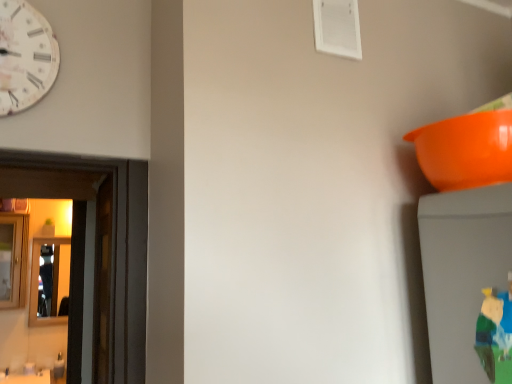
Question: Does shiny silver mirror at left, which appears as the 2th mirror when viewed from the front, have a larger size compared to orange plastic bowl at upper right?

Choices:
 (A) yes
 (B) no

Answer: (A)

Question: Is shiny silver mirror at left, the first mirror positioned from the back, in front of orange plastic bowl at upper right?

Choices:
 (A) no
 (B) yes

Answer: (A)

Question: From the image's perspective, is shiny silver mirror at left, which appears as the 2th mirror when viewed from the front, over orange plastic bowl at upper right?

Choices:
 (A) yes
 (B) no

Answer: (B)

Question: Is orange plastic bowl at upper right inside shiny silver mirror at left, which appears as the 2th mirror when viewed from the front?

Choices:
 (A) yes
 (B) no

Answer: (B)

Question: Does shiny silver mirror at left, the first mirror positioned from the back, appear on the right side of orange plastic bowl at upper right?

Choices:
 (A) no
 (B) yes

Answer: (A)

Question: Is orange plastic bowl at upper right inside or outside of white paper-like clock at upper left?

Choices:
 (A) inside
 (B) outside

Answer: (B)

Question: Would you say orange plastic bowl at upper right is to the left or to the right of white paper-like clock at upper left in the picture?

Choices:
 (A) right
 (B) left

Answer: (A)

Question: Is orange plastic bowl at upper right taller or shorter than white paper-like clock at upper left?

Choices:
 (A) short
 (B) tall

Answer: (A)

Question: From the image's perspective, relative to white paper-like clock at upper left, is orange plastic bowl at upper right above or below?

Choices:
 (A) above
 (B) below

Answer: (B)

Question: Does point (1, 97) appear closer or farther from the camera than point (16, 254)?

Choices:
 (A) closer
 (B) farther

Answer: (A)

Question: Is white paper-like clock at upper left bigger or smaller than wooden mirror at left, the 2th mirror viewed from the back?

Choices:
 (A) small
 (B) big

Answer: (A)

Question: Is white paper-like clock at upper left inside or outside of wooden mirror at left, which is the first mirror from front to back?

Choices:
 (A) outside
 (B) inside

Answer: (A)

Question: From a real-world perspective, relative to wooden mirror at left, the 2th mirror viewed from the back, is white paper-like clock at upper left vertically above or below?

Choices:
 (A) below
 (B) above

Answer: (B)

Question: From the image's perspective, is wooden mirror at left, which is the first mirror from front to back, located above or below shiny silver mirror at left, which appears as the 2th mirror when viewed from the front?

Choices:
 (A) below
 (B) above

Answer: (B)

Question: Considering the positions of wooden mirror at left, the 2th mirror viewed from the back, and shiny silver mirror at left, which appears as the 2th mirror when viewed from the front, in the image, is wooden mirror at left, the 2th mirror viewed from the back, taller or shorter than shiny silver mirror at left, which appears as the 2th mirror when viewed from the front,?

Choices:
 (A) short
 (B) tall

Answer: (A)